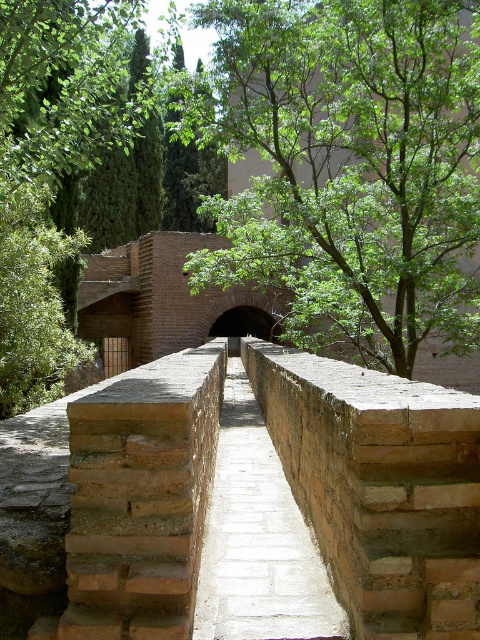
Question: Can you confirm if green leafy tree at center is positioned to the left of smooth stone path at center?

Choices:
 (A) no
 (B) yes

Answer: (A)

Question: Can you confirm if green leafy tree at center is wider than smooth stone path at center?

Choices:
 (A) no
 (B) yes

Answer: (A)

Question: Which object is closer to the camera taking this photo?

Choices:
 (A) green leafy tree at center
 (B) smooth stone path at center

Answer: (B)

Question: Can you confirm if green leafy tree at center is bigger than smooth stone path at center?

Choices:
 (A) no
 (B) yes

Answer: (A)

Question: Among these objects, which one is nearest to the camera?

Choices:
 (A) green leafy tree at center
 (B) smooth stone path at center

Answer: (B)

Question: Which point is farther from the camera taking this photo?

Choices:
 (A) (312, 608)
 (B) (276, 259)

Answer: (B)